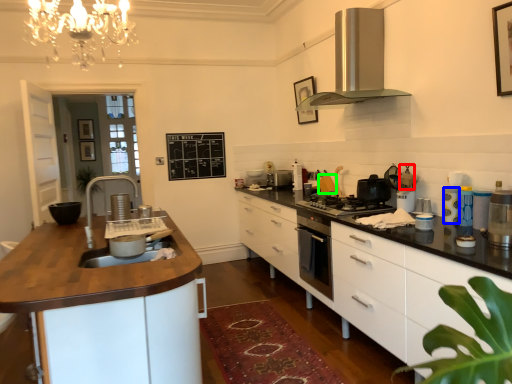
Question: Considering the real-world distances, which object is closest to appliance (highlighted by a red box)? appliance (highlighted by a blue box) or appliance (highlighted by a green box).

Choices:
 (A) appliance
 (B) appliance

Answer: (A)